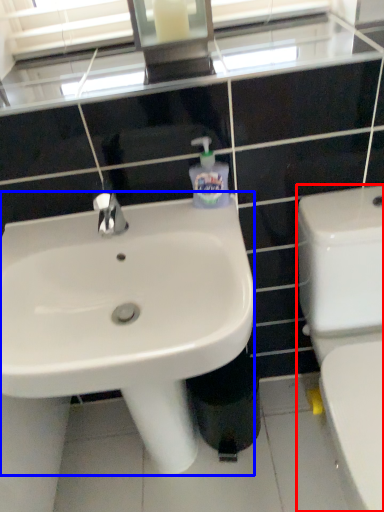
Question: Which object appears closest to the camera in this image, toilet (highlighted by a red box) or sink (highlighted by a blue box)?

Choices:
 (A) toilet
 (B) sink

Answer: (A)